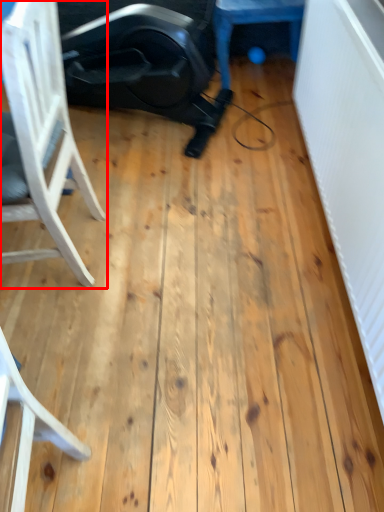
Question: From the image's perspective, where is chair (annotated by the red box) located in relation to furniture in the image?

Choices:
 (A) above
 (B) below

Answer: (B)